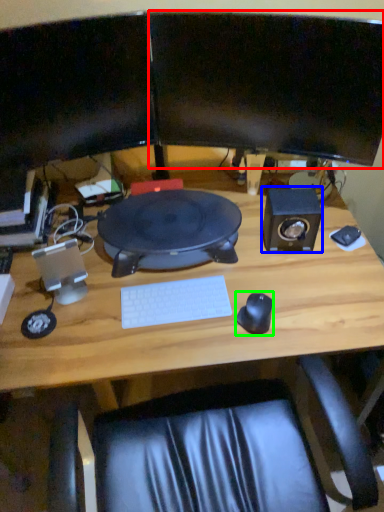
Question: Which object is positioned closest to computer monitor (highlighted by a red box)? Select from speaker (highlighted by a blue box) and mouse (highlighted by a green box).

Choices:
 (A) speaker
 (B) mouse

Answer: (A)